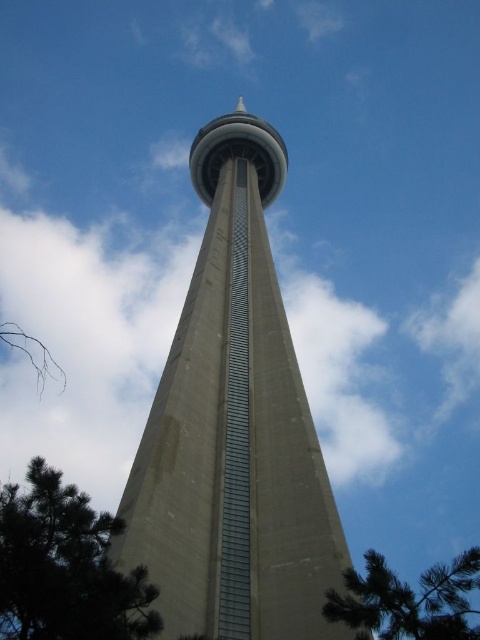
Is concrete tower at center taller than green leafy tree at lower left?

Correct, concrete tower at center is much taller as green leafy tree at lower left.

Which is below, concrete tower at center or green leafy tree at lower left?

green leafy tree at lower left is lower down.

What do you see at coordinates (233, 428) in the screenshot?
I see `concrete tower at center` at bounding box center [233, 428].

The height and width of the screenshot is (640, 480). I want to click on concrete tower at center, so click(233, 428).

Is point (52, 550) positioned in front of point (456, 586)?

No.

Does green leafy tree at lower left have a larger size compared to green leafy tree at lower right?

No, green leafy tree at lower left is not bigger than green leafy tree at lower right.

This screenshot has width=480, height=640. Describe the element at coordinates (66, 566) in the screenshot. I see `green leafy tree at lower left` at that location.

This screenshot has width=480, height=640. In order to click on green leafy tree at lower left in this screenshot , I will do `click(66, 566)`.

Is concrete tower at center further to camera compared to green leafy tree at lower right?

Yes, it is.

In the scene shown: Who is more distant from viewer, (x=157, y=600) or (x=446, y=627)?

The point (x=157, y=600) is behind.

Is point (259, 211) closer to camera compared to point (379, 602)?

That is False.

You are a GUI agent. You are given a task and a screenshot of the screen. Output one action in this format:
    pyautogui.click(x=<x>, y=<y>)
    Task: Click on the concrete tower at center
    The height and width of the screenshot is (640, 480).
    Given the screenshot: What is the action you would take?
    pyautogui.click(x=233, y=428)